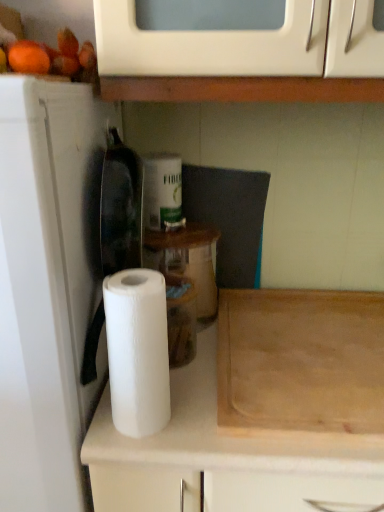
Where is `vacant space situated above white matte paper towel roll at center (from a real-world perspective)`? vacant space situated above white matte paper towel roll at center (from a real-world perspective) is located at coordinates (291, 355).